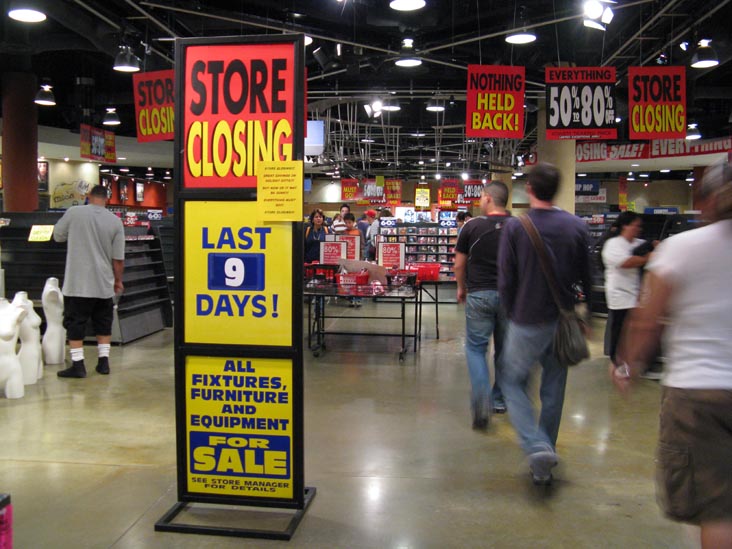
At what (x,y) coordinates should I click in order to perform the action: click on display shelves. Please return your answer as a coordinate pair (x, y). Looking at the image, I should click on (138, 268), (34, 261), (167, 237).